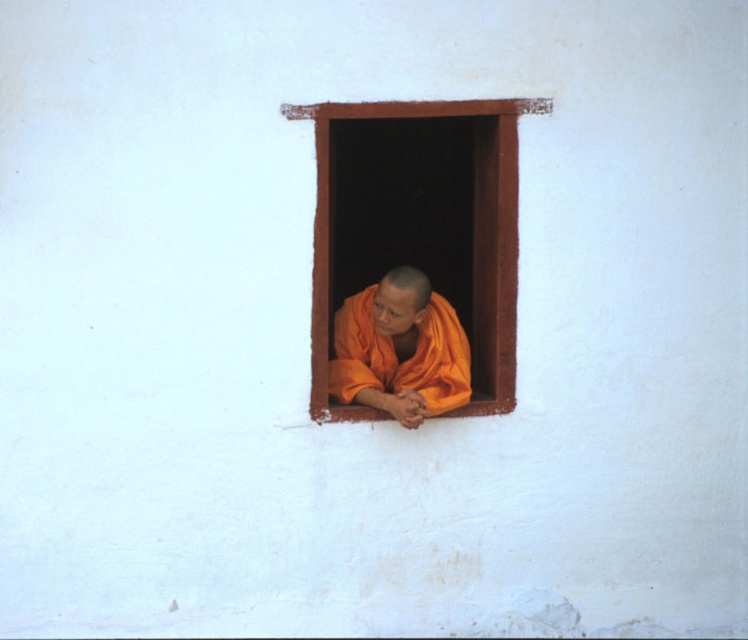
You are standing in front of the window with the monk in orange robes. There are two points marked on the window frame at coordinates point (361,380) and point (506,321). If you want to touch the point closer to you, which coordinate should you aim for?

You should aim for point (361,380) because it is closer to you than point (506,321).

You are an architect designing a new monastery. You want to ensure that the orange cloth monk at center can be seen clearly from the courtyard outside. Given the brown wooden window at center, which object should be placed to the left to achieve this?

The orange cloth monk at center should be placed to the left of the brown wooden window at center to ensure visibility from the courtyard outside.

You are an interior designer assessing the space in the image. You need to place a decorative item that is 1 meter wide in the area where the orange cloth monk at center and brown wooden window at center are located. Based on their sizes, can the decorative item fit between them without overlapping?

The orange cloth monk at center has a lesser width compared to the brown wooden window at center. Since the decorative item is 1 meter wide, it depends on the available space between them. However, the description only provides relative size information, not exact distances. Without knowing the exact dimensions of the monk and window, it is impossible to determine if the 1 meter wide item will fit between them.